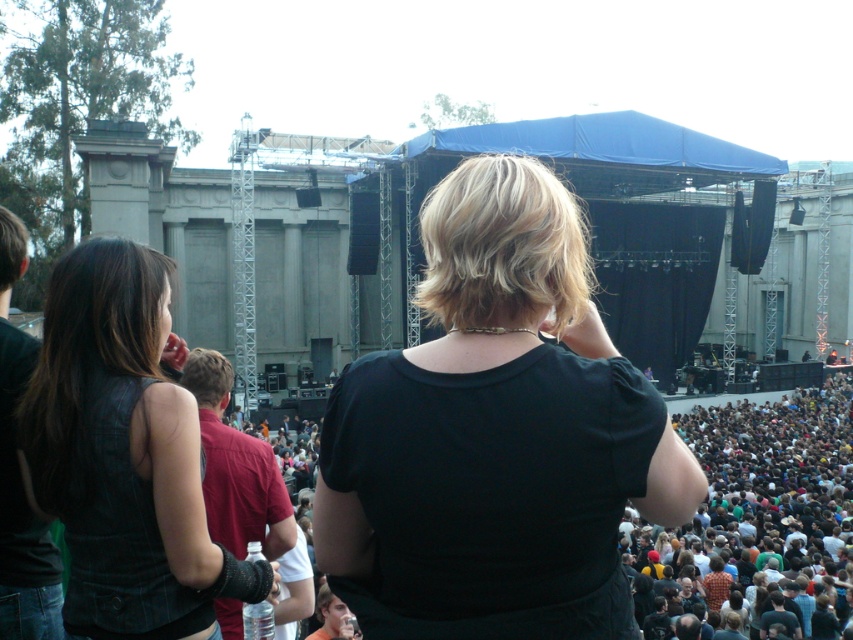
You are a photographer at the concert and want to capture both the black matte shirt at center and the dark brown hair at lower right in the same frame. Based on their positions, which one should you adjust your camera to focus on first to ensure both are in the shot?

Since the black matte shirt at center is positioned on the left side of dark brown hair at lower right, you should focus on the dark brown hair at lower right first to ensure both are included in the frame.

You are at the concert and want to move towards the stage. There is a leather vest at left and a dark brown hair at lower right in your view. Which direction should you move to get closer to the stage?

Since the leather vest at left is to the left of dark brown hair at lower right, moving towards the right direction would align you closer to the stage as the stage is the central focus of the scene.